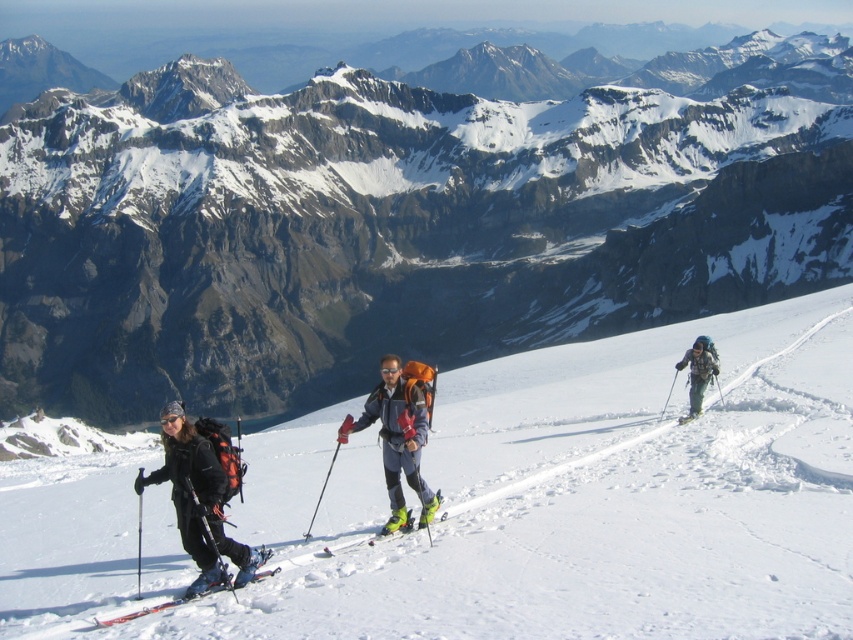
Does matte gray ski suit at center have a larger size compared to matte black ski at right?

Yes, matte gray ski suit at center is bigger than matte black ski at right.

Who is more forward, (383, 451) or (698, 412)?

Point (383, 451) is more forward.

Where is `matte gray ski suit at center`? The height and width of the screenshot is (640, 853). matte gray ski suit at center is located at coordinates (399, 433).

How much distance is there between white snow ski slope at center and matte black ski suit at left?

They are 154.40 feet apart.

Looking at this image, does white snow ski slope at center have a lesser width compared to matte black ski suit at left?

In fact, white snow ski slope at center might be wider than matte black ski suit at left.

Which is in front, point (659, 564) or point (199, 554)?

Point (659, 564) is more forward.

Where is `white snow ski slope at center`? white snow ski slope at center is located at coordinates (511, 504).

At what (x,y) coordinates should I click in order to perform the action: click on matte gray rock at center. Please return your answer as a coordinate pair (x, y). This screenshot has height=640, width=853. Looking at the image, I should click on (399, 220).

How much distance is there between matte gray rock at center and matte gray ski suit at center?

matte gray rock at center is 491.66 feet away from matte gray ski suit at center.

What do you see at coordinates (399, 220) in the screenshot? This screenshot has height=640, width=853. I see `matte gray rock at center` at bounding box center [399, 220].

Find the location of a particular element. The height and width of the screenshot is (640, 853). matte gray rock at center is located at coordinates (399, 220).